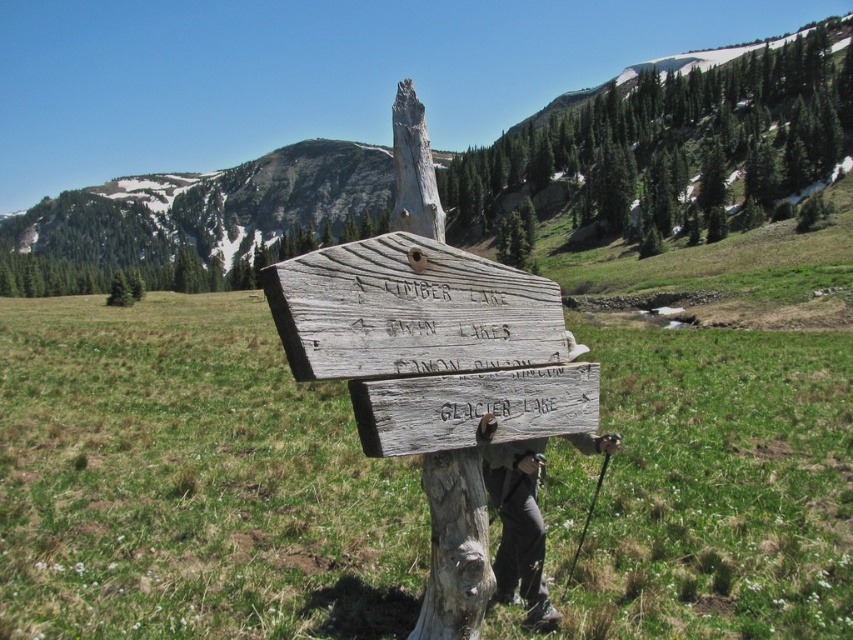
Question: Where is green grassy at center located in relation to dark gray fabric pants at lower center in the image?

Choices:
 (A) left
 (B) right

Answer: (A)

Question: Which is nearer to the green textured tree at upper center?

Choices:
 (A) weathered wood sign at center
 (B) weathered wood tree trunk at center

Answer: (A)

Question: Which object is positioned farthest from the gray wood signpost at center?

Choices:
 (A) green grassy at center
 (B) weathered wood sign at center

Answer: (B)

Question: Can you confirm if gray wood signpost at center is positioned to the left of green textured tree at upper center?

Choices:
 (A) no
 (B) yes

Answer: (B)

Question: Which object is the farthest from the weathered wood sign at center?

Choices:
 (A) green textured tree at upper center
 (B) gray wood signpost at center

Answer: (B)

Question: Does green grassy at center have a smaller size compared to dark gray fabric pants at lower center?

Choices:
 (A) yes
 (B) no

Answer: (B)